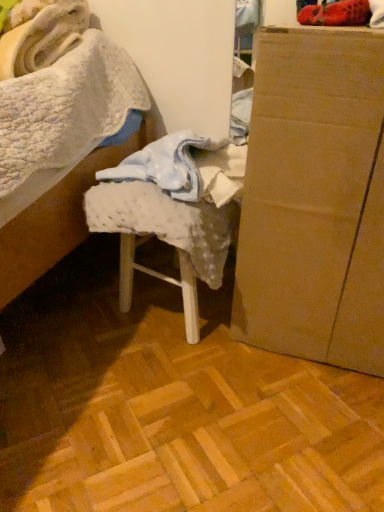
What do you see at coordinates (172, 211) in the screenshot? I see `white textured fabric at center` at bounding box center [172, 211].

The image size is (384, 512). In order to click on white textured fabric at center in this screenshot , I will do `click(172, 211)`.

What are the coordinates of `cardboard box at right` in the screenshot? It's located at (315, 200).

Measure the distance between cardboard box at right and camera.

cardboard box at right is 22.22 inches from camera.

This screenshot has width=384, height=512. Describe the element at coordinates (315, 200) in the screenshot. I see `cardboard box at right` at that location.

The width and height of the screenshot is (384, 512). Find the location of `white textured fabric at center`. white textured fabric at center is located at coordinates (172, 211).

In the scene shown: Considering the positions of objects cardboard box at right and white textured fabric at center in the image provided, who is more to the right, cardboard box at right or white textured fabric at center?

From the viewer's perspective, cardboard box at right appears more on the right side.

Is cardboard box at right in front of or behind white textured fabric at center in the image?

cardboard box at right is in front of white textured fabric at center.

Which is further, (x=249, y=231) or (x=195, y=307)?

The point (x=195, y=307) is more distant.

From the image's perspective, is cardboard box at right above or below white textured fabric at center?

Based on their image positions, cardboard box at right is located above white textured fabric at center.

From a real-world perspective, who is located lower, cardboard box at right or white textured fabric at center?

From a 3D spatial view, white textured fabric at center is below.

Which object is wider, cardboard box at right or white textured fabric at center?

Wider between the two is cardboard box at right.

Can you confirm if cardboard box at right is taller than white textured fabric at center?

Yes, cardboard box at right is taller than white textured fabric at center.

Considering the sizes of cardboard box at right and white textured fabric at center in the image, is cardboard box at right bigger or smaller than white textured fabric at center?

Clearly, cardboard box at right is larger in size than white textured fabric at center.

Can we say cardboard box at right lies outside white textured fabric at center?

Yes, cardboard box at right is located beyond the bounds of white textured fabric at center.

From the picture: Is cardboard box at right beside white textured fabric at center?

No, cardboard box at right is not making contact with white textured fabric at center.

Is cardboard box at right turned away from white textured fabric at center?

No, cardboard box at right is not facing away from white textured fabric at center.

Can you tell me how much cardboard box at right and white textured fabric at center differ in facing direction?

The facing directions of cardboard box at right and white textured fabric at center are 12.8 degrees apart.

At what (x,y) coordinates should I click in order to perform the action: click on furniture in front of the white textured fabric at center. Please return your answer as a coordinate pair (x, y). Looking at the image, I should click on (315, 200).

Which is more to the left, white textured fabric at center or cardboard box at right?

white textured fabric at center is more to the left.

Is white textured fabric at center positioned behind cardboard box at right?

Yes.

Considering the points (125, 167) and (314, 42), which point is in front, point (125, 167) or point (314, 42)?

Positioned in front is point (314, 42).

From the image's perspective, is white textured fabric at center beneath cardboard box at right?

Correct, white textured fabric at center appears lower than cardboard box at right in the image.

From a real-world perspective, which object rests below the other?

From a 3D spatial view, white textured fabric at center is below.

Which object is thinner, white textured fabric at center or cardboard box at right?

Thinner between the two is white textured fabric at center.

Considering the sizes of objects white textured fabric at center and cardboard box at right in the image provided, who is taller, white textured fabric at center or cardboard box at right?

Standing taller between the two is cardboard box at right.

Is white textured fabric at center smaller than cardboard box at right?

Indeed, white textured fabric at center has a smaller size compared to cardboard box at right.

Can cardboard box at right be found inside white textured fabric at center?

Definitely not — cardboard box at right is not inside white textured fabric at center.

Is white textured fabric at center with cardboard box at right?

white textured fabric at center and cardboard box at right are clearly separated.

Is white textured fabric at center aimed at cardboard box at right?

No, white textured fabric at center is not aimed at cardboard box at right.

The height and width of the screenshot is (512, 384). I want to click on furniture that appears in front of the white textured fabric at center, so (315, 200).

You are a GUI agent. You are given a task and a screenshot of the screen. Output one action in this format:
    pyautogui.click(x=<x>, y=<y>)
    Task: Click on the furniture on the right of white textured fabric at center
    The width and height of the screenshot is (384, 512).
    Given the screenshot: What is the action you would take?
    pyautogui.click(x=315, y=200)

Where is `chair that is below the cardboard box at right (from the image's perspective)`? This screenshot has height=512, width=384. chair that is below the cardboard box at right (from the image's perspective) is located at coordinates (172, 211).